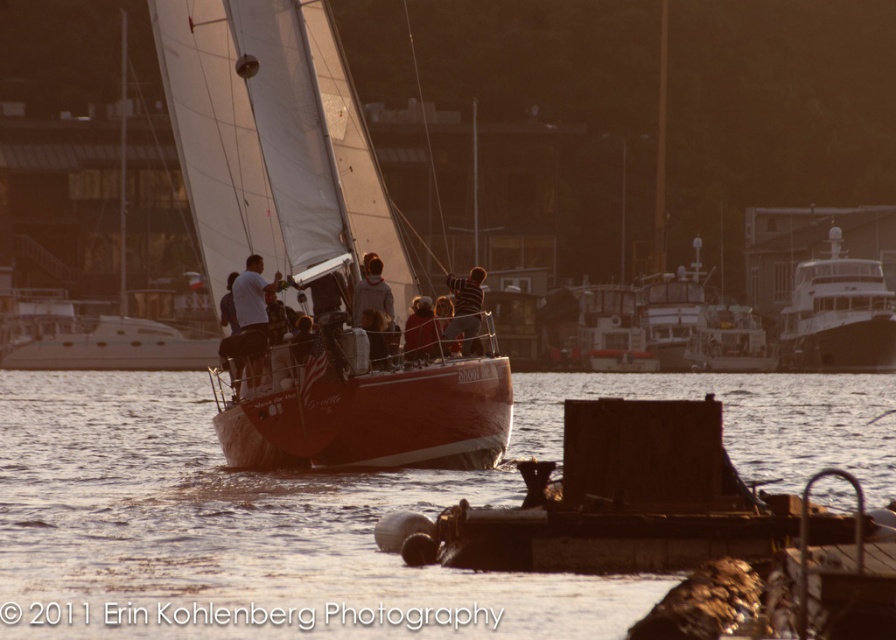
What are the coordinates of the shiny red sailboat at center?

The shiny red sailboat at center is located at coordinates point (273, 140).

You are standing on the dock and want to take a photo of the shiny red sailboat at center. If your camera has a maximum zoom range of 100 feet, can you capture the entire sailboat in your photo without moving closer?

The shiny red sailboat at center and camera are 149.85 feet apart. Since the camera can only zoom up to 100 feet, you cannot capture the entire sailboat without moving closer.